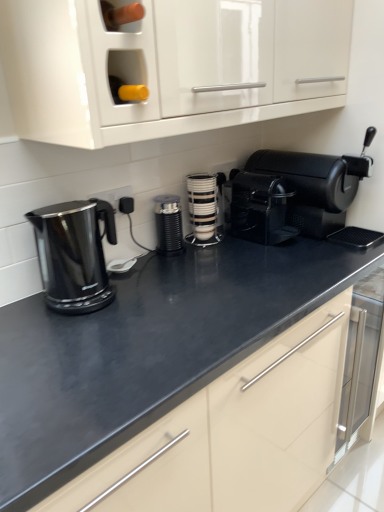
Question: Is black matte coffee grinder at center, which is the first kitchen appliance from left to right, not within black matte coffee machine at right?

Choices:
 (A) yes
 (B) no

Answer: (A)

Question: Does black matte coffee grinder at center, which is the first kitchen appliance from left to right, have a lesser height compared to black matte coffee machine at right?

Choices:
 (A) no
 (B) yes

Answer: (B)

Question: Can you confirm if black matte coffee grinder at center, which is counted as the second kitchen appliance, starting from the right, is thinner than black matte coffee machine at right?

Choices:
 (A) no
 (B) yes

Answer: (B)

Question: From a real-world perspective, is black matte coffee grinder at center, which is the first kitchen appliance from left to right, beneath black matte coffee machine at right?

Choices:
 (A) no
 (B) yes

Answer: (B)

Question: From the image's perspective, is black matte coffee grinder at center, which is the first kitchen appliance from left to right, located above black matte coffee machine at right?

Choices:
 (A) yes
 (B) no

Answer: (B)

Question: Based on their sizes in the image, would you say black plastic coffee maker at center is bigger or smaller than white glossy cup stack at center, arranged as the 2th kitchen appliance when viewed from the left?

Choices:
 (A) big
 (B) small

Answer: (A)

Question: Relative to white glossy cup stack at center, arranged as the 2th kitchen appliance when viewed from the left, is black plastic coffee maker at center in front or behind?

Choices:
 (A) front
 (B) behind

Answer: (A)

Question: Is black plastic coffee maker at center to the left or to the right of white glossy cup stack at center, arranged as the 2th kitchen appliance when viewed from the left, in the image?

Choices:
 (A) right
 (B) left

Answer: (A)

Question: Is black plastic coffee maker at center spatially inside white glossy cup stack at center, which appears as the first kitchen appliance when viewed from the right, or outside of it?

Choices:
 (A) inside
 (B) outside

Answer: (B)

Question: From a real-world perspective, is black matte coffee grinder at center, which is counted as the second kitchen appliance, starting from the right, physically located above or below white glossy cup stack at center, arranged as the 2th kitchen appliance when viewed from the left?

Choices:
 (A) above
 (B) below

Answer: (B)

Question: Is black matte coffee grinder at center, which is the first kitchen appliance from left to right, to the left or to the right of white glossy cup stack at center, which appears as the first kitchen appliance when viewed from the right, in the image?

Choices:
 (A) right
 (B) left

Answer: (B)

Question: Looking at the image, does black matte coffee grinder at center, which is counted as the second kitchen appliance, starting from the right, seem bigger or smaller compared to white glossy cup stack at center, which appears as the first kitchen appliance when viewed from the right?

Choices:
 (A) big
 (B) small

Answer: (B)

Question: Is black matte coffee grinder at center, which is counted as the second kitchen appliance, starting from the right, inside the boundaries of white glossy cup stack at center, which appears as the first kitchen appliance when viewed from the right, or outside?

Choices:
 (A) outside
 (B) inside

Answer: (A)

Question: In terms of width, does black matte coffee grinder at center, which is counted as the second kitchen appliance, starting from the right, look wider or thinner when compared to black matte coffee machine at right?

Choices:
 (A) wide
 (B) thin

Answer: (B)

Question: Considering the positions of point (157, 221) and point (322, 164), is point (157, 221) closer or farther from the camera than point (322, 164)?

Choices:
 (A) closer
 (B) farther

Answer: (A)